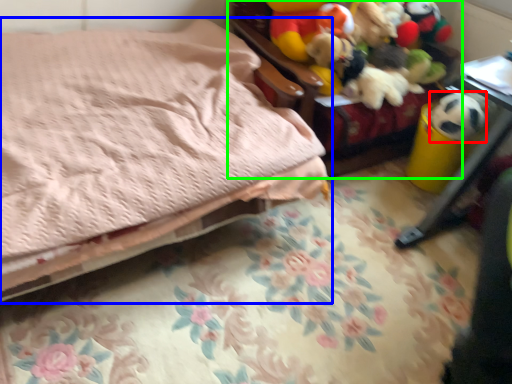
Question: Based on their relative distances, which object is nearer to animal (highlighted by a red box)? Choose from bed (highlighted by a blue box) and furniture (highlighted by a green box).

Choices:
 (A) bed
 (B) furniture

Answer: (B)